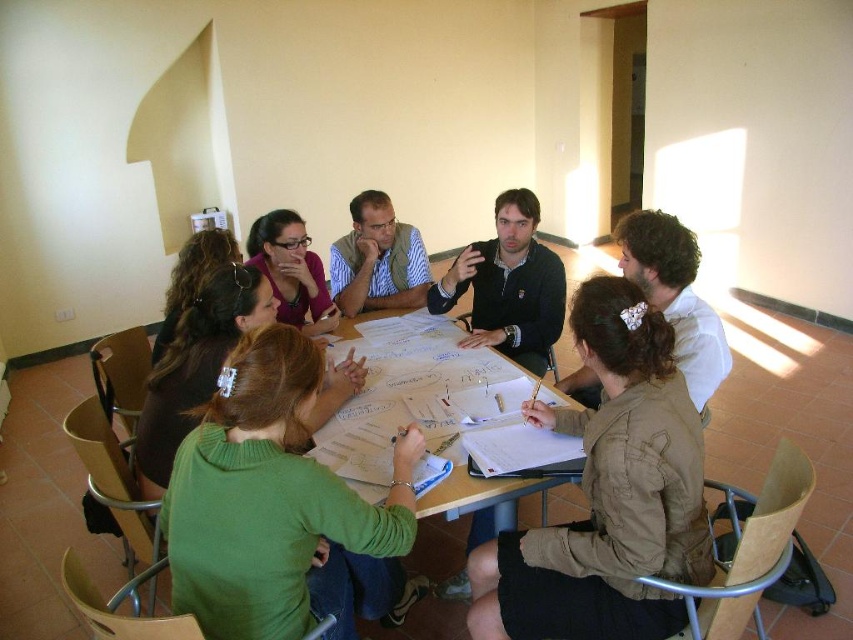
Is white paper at center positioned in front of striped fabric shirt at center?

Yes, it is in front of striped fabric shirt at center.

Does white paper at center appear on the right side of striped fabric shirt at center?

Indeed, white paper at center is positioned on the right side of striped fabric shirt at center.

Between point (428, 378) and point (404, 296), which one is positioned in front?

Point (428, 378) is in front.

Find the location of a particular element. The height and width of the screenshot is (640, 853). white paper at center is located at coordinates (427, 413).

Can you confirm if green sweater at center is shorter than white paper at center?

In fact, green sweater at center may be taller than white paper at center.

Identify the location of green sweater at center. (280, 508).

The image size is (853, 640). What do you see at coordinates (280, 508) in the screenshot?
I see `green sweater at center` at bounding box center [280, 508].

Where is `green sweater at center`? This screenshot has width=853, height=640. green sweater at center is located at coordinates (280, 508).

Who is more forward, (x=566, y=595) or (x=390, y=298)?

Positioned in front is point (x=566, y=595).

Is brown quilted jacket at center taller than striped fabric shirt at center?

Indeed, brown quilted jacket at center has a greater height compared to striped fabric shirt at center.

Is point (514, 620) less distant than point (416, 282)?

That is True.

The height and width of the screenshot is (640, 853). Identify the location of brown quilted jacket at center. (608, 493).